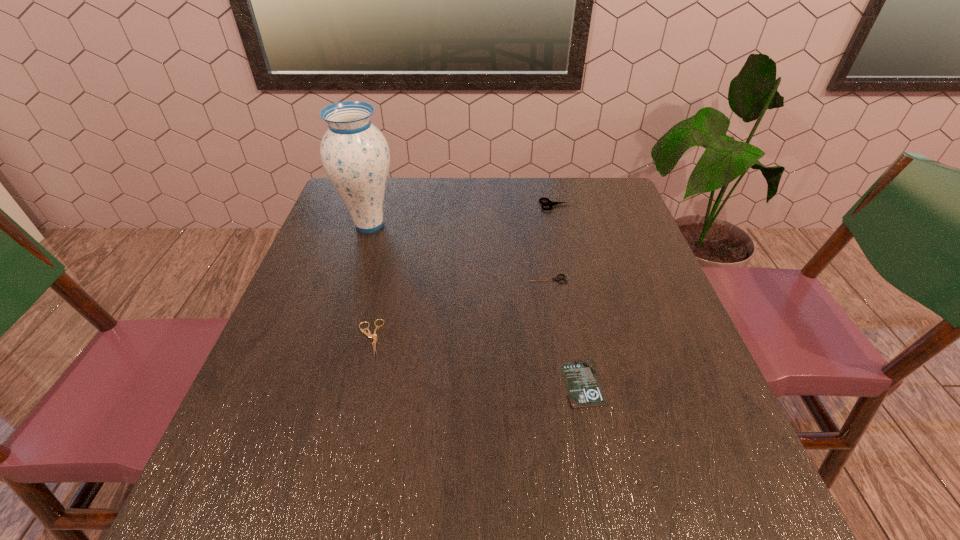
Find the location of a particular element. vase is located at coordinates (355, 154).

At what (x,y) coordinates should I click in order to perform the action: click on the farthest shears. Please return your answer as a coordinate pair (x, y). The image size is (960, 540). Looking at the image, I should click on (550, 203).

The width and height of the screenshot is (960, 540). What are the coordinates of `the tallest shears` in the screenshot? It's located at (550, 203).

Where is `the third farthest object`? the third farthest object is located at coordinates pyautogui.click(x=556, y=278).

Find the location of a particular element. the shortest shears is located at coordinates (369, 335).

Find the location of `the leftmost shears`. the leftmost shears is located at coordinates (369, 335).

Locate an element on the screen. This screenshot has width=960, height=540. the shortest object is located at coordinates (584, 391).

Identify the location of the nearest object. The width and height of the screenshot is (960, 540). (584, 391).

The image size is (960, 540). Find the location of `vacant region located 0.190m on the front of the vase`. vacant region located 0.190m on the front of the vase is located at coordinates (348, 293).

You are a GUI agent. You are given a task and a screenshot of the screen. Output one action in this format:
    pyautogui.click(x=<x>, y=<y>)
    Task: Click on the free space located on the left of the second tallest object
    The height and width of the screenshot is (540, 960).
    Given the screenshot: What is the action you would take?
    pyautogui.click(x=438, y=205)